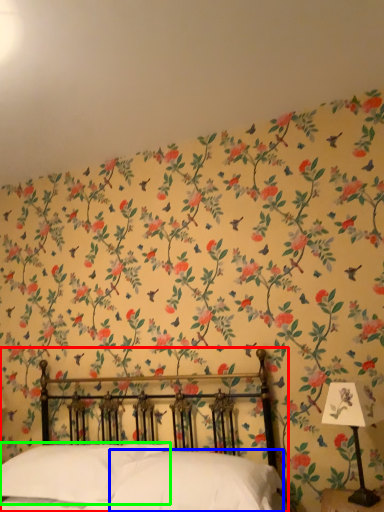
Question: Estimate the real-world distances between objects in this image. Which object is closer to bed (highlighted by a red box), pillow (highlighted by a blue box) or pillow (highlighted by a green box)?

Choices:
 (A) pillow
 (B) pillow

Answer: (B)